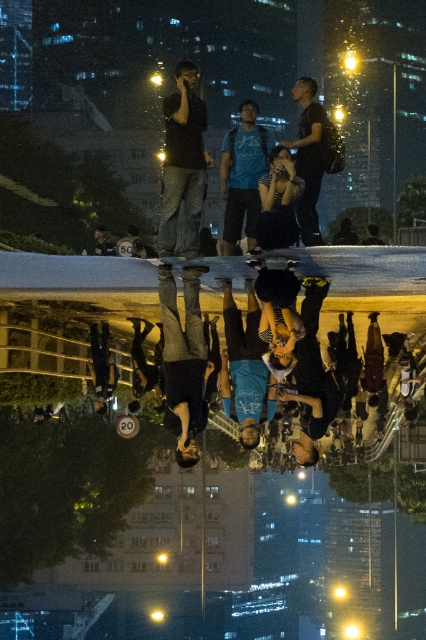
Which is above, dark brown leather skateboard at center or matte black phone at center?

matte black phone at center is above.

At what (x,y) coordinates should I click in order to perform the action: click on dark brown leather skateboard at center. Please return your answer as a coordinate pair (x, y). This screenshot has height=640, width=426. Looking at the image, I should click on (184, 360).